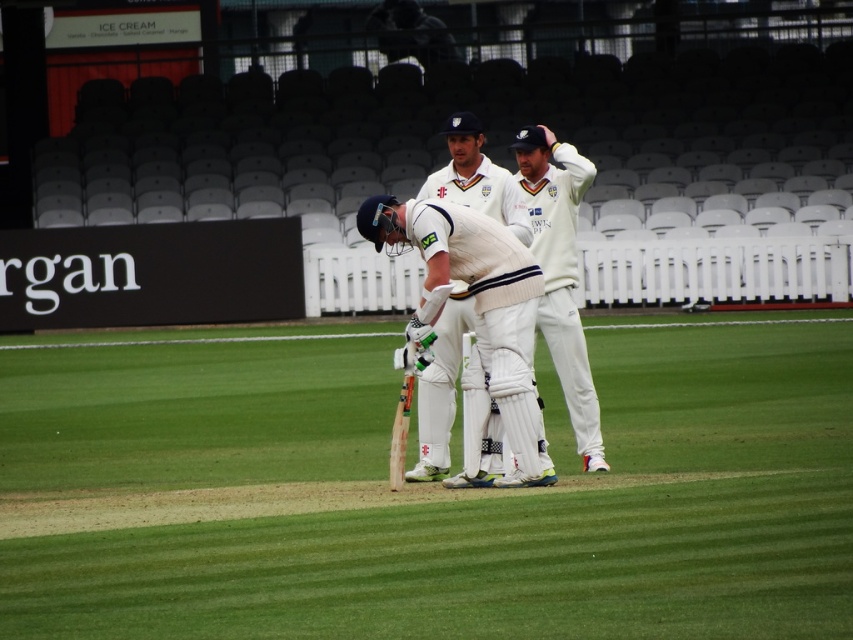
Question: Among these points, which one is farthest from the camera?

Choices:
 (A) (447, 266)
 (B) (498, 176)

Answer: (B)

Question: Which object is positioned closest to the white cotton cricket uniform at center?

Choices:
 (A) white matte cricket bat at center
 (B) white textured cricket uniform at center

Answer: (A)

Question: Which object is farther from the camera taking this photo?

Choices:
 (A) white matte cricket bat at center
 (B) white cotton cricket uniform at center
 (C) white textured cricket uniform at center

Answer: (C)

Question: Can you confirm if white textured cricket uniform at center is thinner than white matte cricket bat at center?

Choices:
 (A) no
 (B) yes

Answer: (B)

Question: Is white cotton cricket uniform at center wider than white matte cricket bat at center?

Choices:
 (A) no
 (B) yes

Answer: (B)

Question: In this image, where is white cotton cricket uniform at center located relative to white textured cricket uniform at center?

Choices:
 (A) left
 (B) right

Answer: (A)